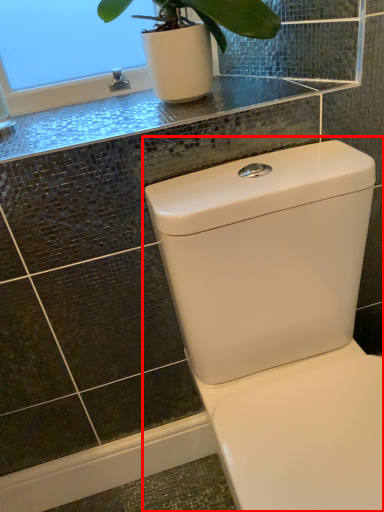
Question: From the image's perspective, where is toilet (annotated by the red box) located relative to counter top?

Choices:
 (A) below
 (B) above

Answer: (A)